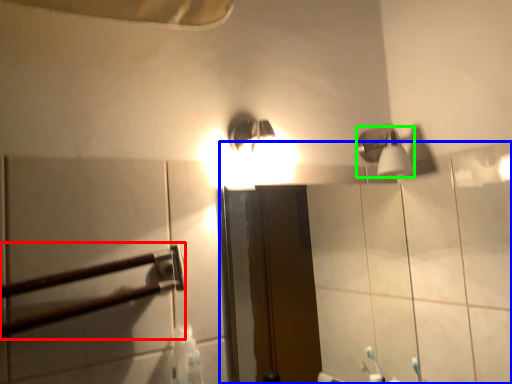
Question: Considering the real-world distances, which object is closest to rail (highlighted by a red box)? mirror (highlighted by a blue box) or shower (highlighted by a green box).

Choices:
 (A) mirror
 (B) shower

Answer: (B)